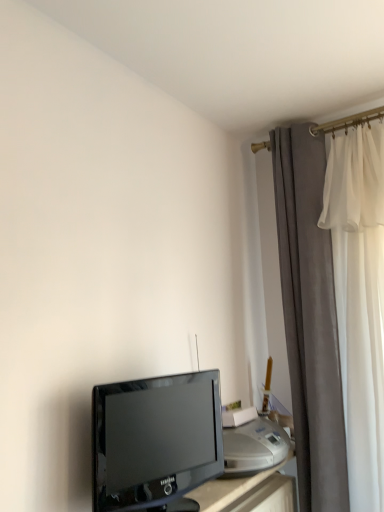
Question: Considering the relative sizes of velvet gray curtain at right and satin silver printer at lower right in the image provided, is velvet gray curtain at right thinner than satin silver printer at lower right?

Choices:
 (A) no
 (B) yes

Answer: (A)

Question: From the image's perspective, is velvet gray curtain at right on satin silver printer at lower right?

Choices:
 (A) no
 (B) yes

Answer: (B)

Question: Is velvet gray curtain at right closer to the viewer compared to satin silver printer at lower right?

Choices:
 (A) no
 (B) yes

Answer: (A)

Question: Is velvet gray curtain at right facing towards satin silver printer at lower right?

Choices:
 (A) no
 (B) yes

Answer: (A)

Question: Is velvet gray curtain at right shorter than satin silver printer at lower right?

Choices:
 (A) yes
 (B) no

Answer: (B)

Question: Is satin silver printer at lower right spatially inside black glossy television at lower left, or outside of it?

Choices:
 (A) inside
 (B) outside

Answer: (B)

Question: In the image, is satin silver printer at lower right on the left side or the right side of black glossy television at lower left?

Choices:
 (A) left
 (B) right

Answer: (B)

Question: From the image's perspective, is satin silver printer at lower right positioned above or below black glossy television at lower left?

Choices:
 (A) below
 (B) above

Answer: (A)

Question: From their relative heights in the image, would you say satin silver printer at lower right is taller or shorter than black glossy television at lower left?

Choices:
 (A) tall
 (B) short

Answer: (B)

Question: From a real-world perspective, is velvet gray curtain at right physically located above or below satin silver printer at lower right?

Choices:
 (A) above
 (B) below

Answer: (A)

Question: Is point (279, 222) positioned closer to the camera than point (243, 426)?

Choices:
 (A) closer
 (B) farther

Answer: (B)

Question: Is velvet gray curtain at right in front of or behind satin silver printer at lower right in the image?

Choices:
 (A) front
 (B) behind

Answer: (B)

Question: Is velvet gray curtain at right situated inside satin silver printer at lower right or outside?

Choices:
 (A) inside
 (B) outside

Answer: (B)

Question: Is satin silver printer at lower right inside the boundaries of velvet gray curtain at right, or outside?

Choices:
 (A) outside
 (B) inside

Answer: (A)

Question: From the image's perspective, relative to velvet gray curtain at right, is satin silver printer at lower right above or below?

Choices:
 (A) above
 (B) below

Answer: (B)